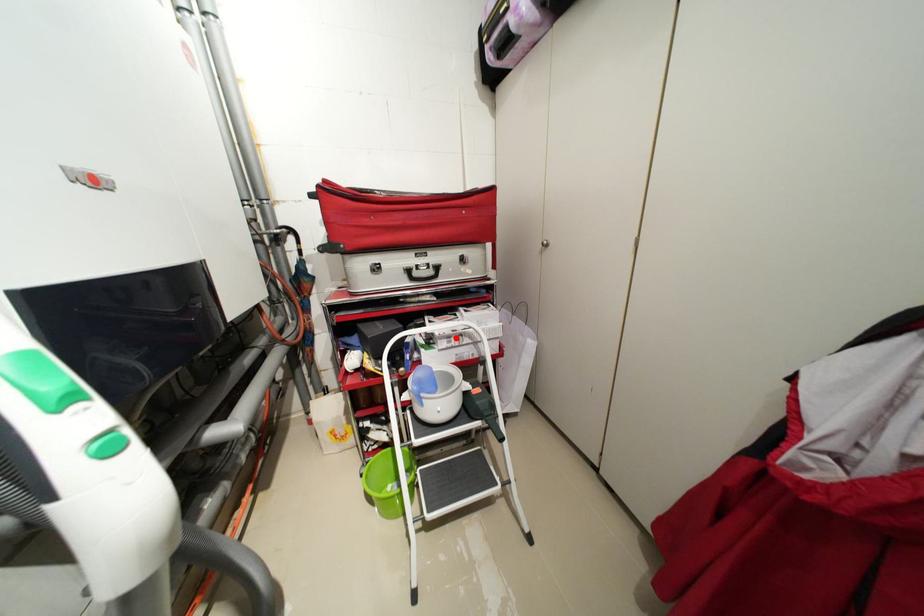
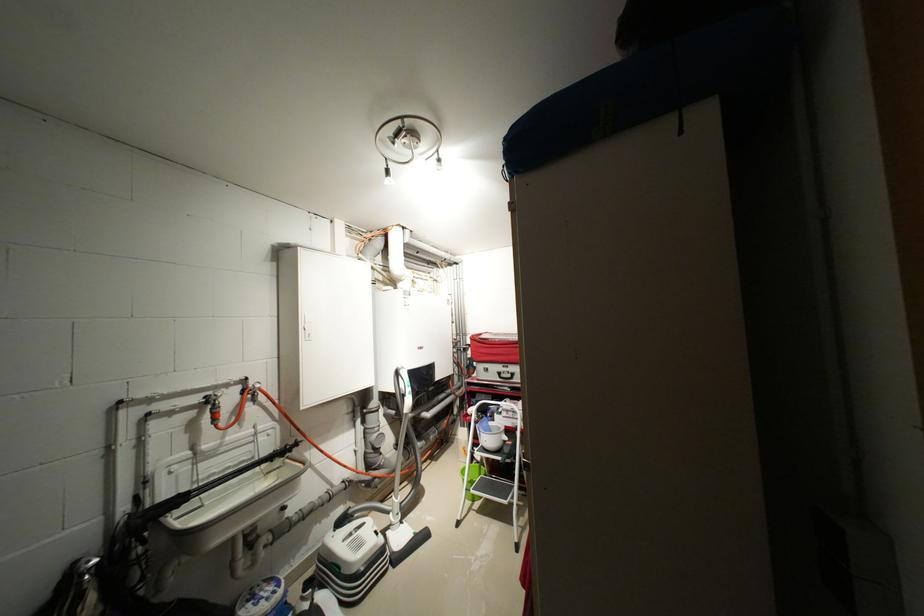
Locate, in the second image, the point that corresponds to the highlighted location in the first image.

(515, 411)